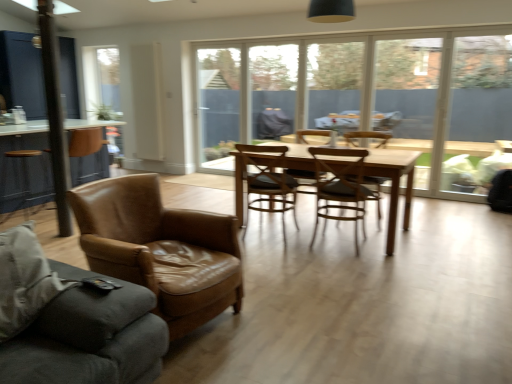
Question: Is leather couch at left at the left side of brown leather armchair at left, the 1th chair in the front-to-back sequence?

Choices:
 (A) yes
 (B) no

Answer: (A)

Question: Would you say leather couch at left is outside brown leather armchair at left, the 5th chair viewed from the back?

Choices:
 (A) no
 (B) yes

Answer: (B)

Question: Does leather couch at left appear on the right side of brown leather armchair at left, the 5th chair viewed from the back?

Choices:
 (A) no
 (B) yes

Answer: (A)

Question: Does leather couch at left have a greater width compared to brown leather armchair at left, the 1th chair in the front-to-back sequence?

Choices:
 (A) no
 (B) yes

Answer: (B)

Question: Is leather couch at left bigger than brown leather armchair at left, the 5th chair viewed from the back?

Choices:
 (A) no
 (B) yes

Answer: (B)

Question: From their relative heights in the image, would you say brown leather table at left is taller or shorter than leather couch at left?

Choices:
 (A) short
 (B) tall

Answer: (B)

Question: Choose the correct answer: Is brown leather table at left inside leather couch at left or outside it?

Choices:
 (A) inside
 (B) outside

Answer: (B)

Question: From the image's perspective, relative to leather couch at left, is brown leather table at left above or below?

Choices:
 (A) above
 (B) below

Answer: (A)

Question: Relative to leather couch at left, is brown leather table at left in front or behind?

Choices:
 (A) behind
 (B) front

Answer: (A)

Question: Which is correct: brown leather chair at center, the 3th chair from the back, is inside brown leather armchair at left, the 1th chair in the front-to-back sequence, or outside of it?

Choices:
 (A) inside
 (B) outside

Answer: (B)

Question: Is brown leather chair at center, the 3th chair from the back, wider or thinner than brown leather armchair at left, the 5th chair viewed from the back?

Choices:
 (A) thin
 (B) wide

Answer: (A)

Question: Is point (257, 183) closer or farther from the camera than point (225, 266)?

Choices:
 (A) closer
 (B) farther

Answer: (B)

Question: In the image, is brown leather chair at center, the 3th chair from the back, positioned in front of or behind brown leather armchair at left, the 5th chair viewed from the back?

Choices:
 (A) front
 (B) behind

Answer: (B)

Question: Is leather couch at left wider or thinner than wooden chair at center, placed as the 1th chair when sorted from back to front?

Choices:
 (A) wide
 (B) thin

Answer: (A)

Question: Based on their sizes in the image, would you say leather couch at left is bigger or smaller than wooden chair at center, which is the 5th chair from front to back?

Choices:
 (A) big
 (B) small

Answer: (A)